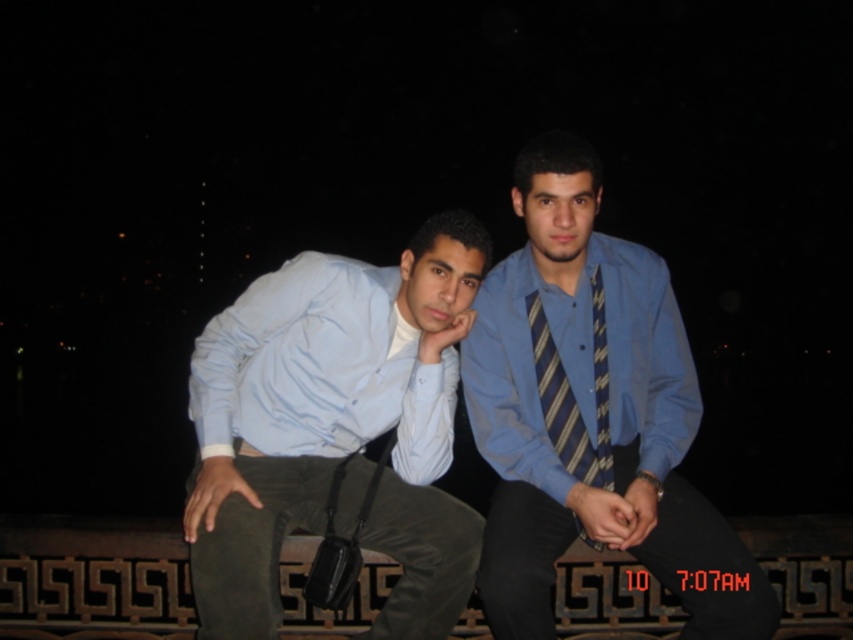
You are standing at point (409, 394) and want to walk to point (242, 580). Which direction should you move relative to the other point?

You should move forward towards point (242, 580) because it is in front of point (409, 394).

Looking at this image, you are taking a photo of the two people in the scene. You notice two specific points in the image at coordinates point (502, 404) and point (567, 448). Which of these points is closer to the camera?

Point (502, 404) is further to the camera than point (567, 448), so the point closer to the camera is point (567, 448).